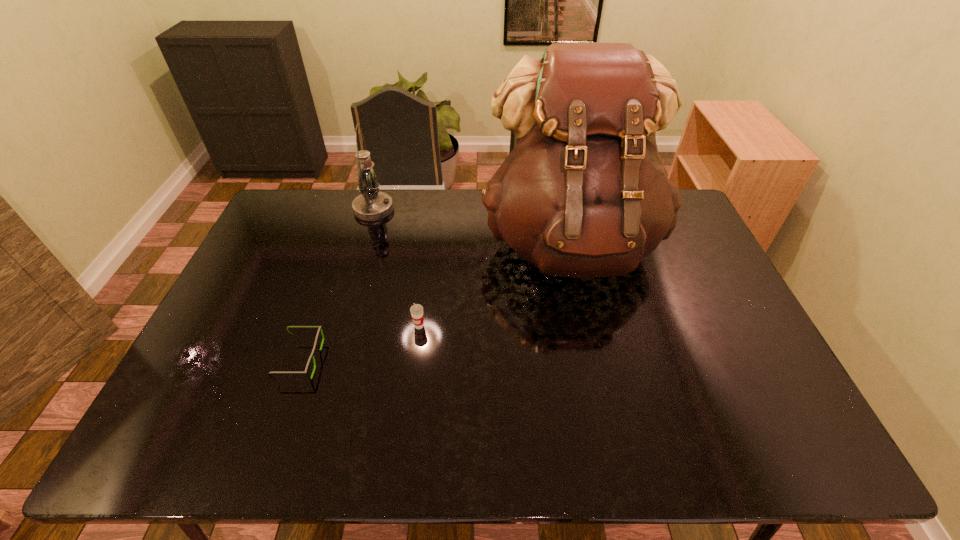
Image resolution: width=960 pixels, height=540 pixels. In order to click on free space between the second nearest object and the oil lamp in this screenshot , I will do `click(396, 267)`.

Image resolution: width=960 pixels, height=540 pixels. In order to click on blank region between the oil lamp and the rightmost object in this screenshot , I will do `click(472, 226)`.

This screenshot has height=540, width=960. Find the location of `free space that is in between the third object from left to right and the tallest object`. free space that is in between the third object from left to right and the tallest object is located at coordinates (494, 285).

Find the location of a particular element. vacant area that lies between the third shortest object and the nearest object is located at coordinates (337, 284).

Locate an element on the screen. The width and height of the screenshot is (960, 540). vacant point located between the spectacles and the second shortest object is located at coordinates (360, 342).

What are the coordinates of `blank region between the oil lamp and the satchel` in the screenshot? It's located at (472, 226).

At what (x,y) coordinates should I click in order to perform the action: click on free space between the shortest object and the third farthest object. Please return your answer as a coordinate pair (x, y). Looking at the image, I should click on (360, 342).

Locate an element on the screen. This screenshot has width=960, height=540. free point between the nearest object and the second tallest object is located at coordinates (337, 284).

The height and width of the screenshot is (540, 960). What are the coordinates of `vacant point located between the spectacles and the rightmost object` in the screenshot? It's located at (436, 301).

Image resolution: width=960 pixels, height=540 pixels. What are the coordinates of `object that is the second closest one to the third shortest object` in the screenshot? It's located at (416, 310).